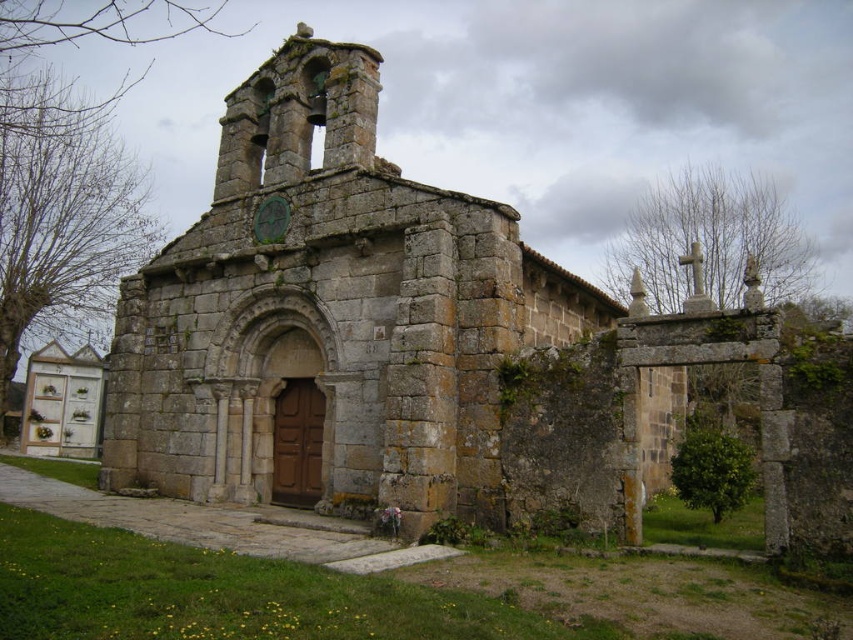
Question: Which object is closer to the camera taking this photo?

Choices:
 (A) stone chapel at center
 (B) green stone clock at upper center

Answer: (A)

Question: Which point is farther to the camera?

Choices:
 (A) click(x=453, y=224)
 (B) click(x=271, y=227)

Answer: (B)

Question: Can you confirm if stone chapel at center is smaller than green stone clock at upper center?

Choices:
 (A) no
 (B) yes

Answer: (A)

Question: Observing the image, what is the correct spatial positioning of stone chapel at center in reference to green stone clock at upper center?

Choices:
 (A) above
 (B) below

Answer: (B)

Question: Which object appears closest to the camera in this image?

Choices:
 (A) stone chapel at center
 (B) green stone clock at upper center

Answer: (A)

Question: Is stone chapel at center in front of green stone clock at upper center?

Choices:
 (A) yes
 (B) no

Answer: (A)